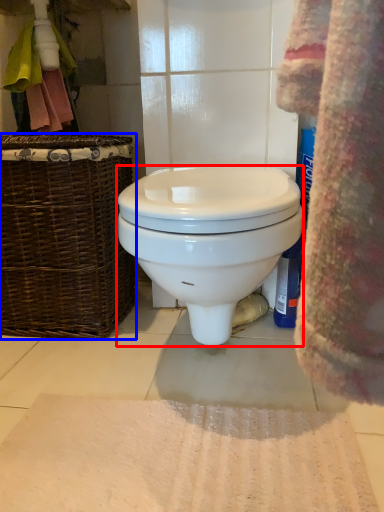
Question: Which object appears closest to the camera in this image, toilet (highlighted by a red box) or picnic basket (highlighted by a blue box)?

Choices:
 (A) toilet
 (B) picnic basket

Answer: (A)